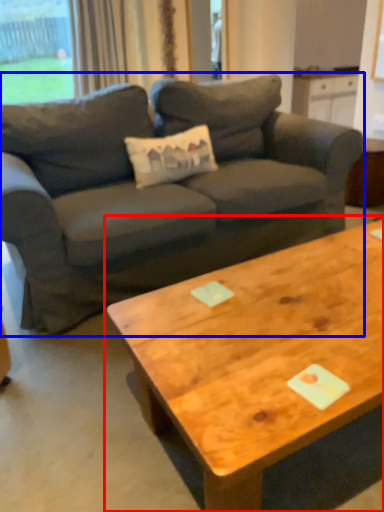
Question: Which object is closer to the camera taking this photo, coffee table (highlighted by a red box) or studio couch (highlighted by a blue box)?

Choices:
 (A) coffee table
 (B) studio couch

Answer: (A)